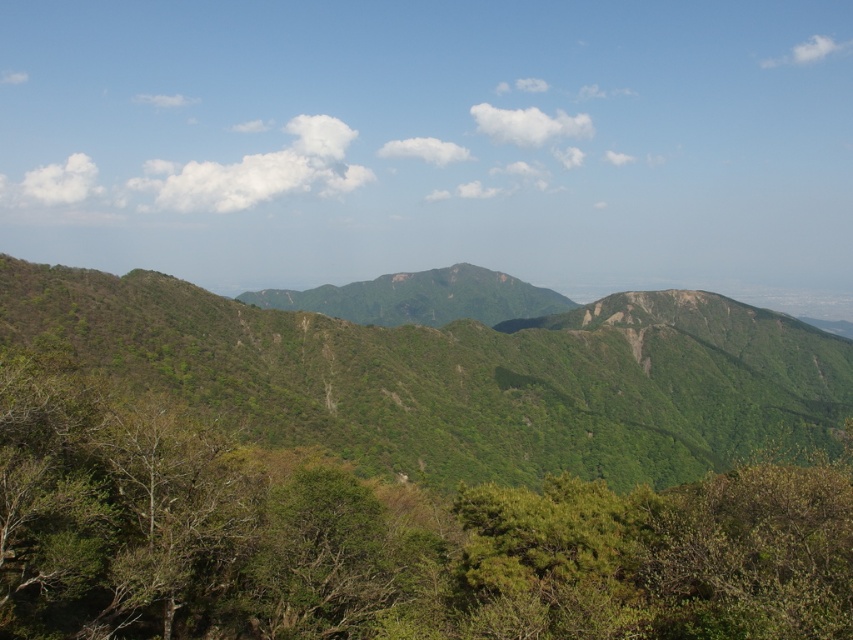
Question: Which object is the farthest from the green rocky mountain at center?

Choices:
 (A) green leafy tree at center
 (B) green leafy mountain at center

Answer: (A)

Question: Which point appears farthest from the camera in this image?

Choices:
 (A) (346, 307)
 (B) (630, 595)
 (C) (77, 323)

Answer: (A)

Question: Based on their relative distances, which object is farther from the green rocky mountain at center?

Choices:
 (A) green leafy tree at center
 (B) green leafy mountain at center

Answer: (A)

Question: Can you confirm if green leafy tree at center is bigger than green leafy mountain at center?

Choices:
 (A) no
 (B) yes

Answer: (A)

Question: In this image, where is green leafy mountain at center located relative to green rocky mountain at center?

Choices:
 (A) left
 (B) right

Answer: (B)

Question: Can you confirm if green leafy mountain at center is positioned to the right of green rocky mountain at center?

Choices:
 (A) yes
 (B) no

Answer: (A)